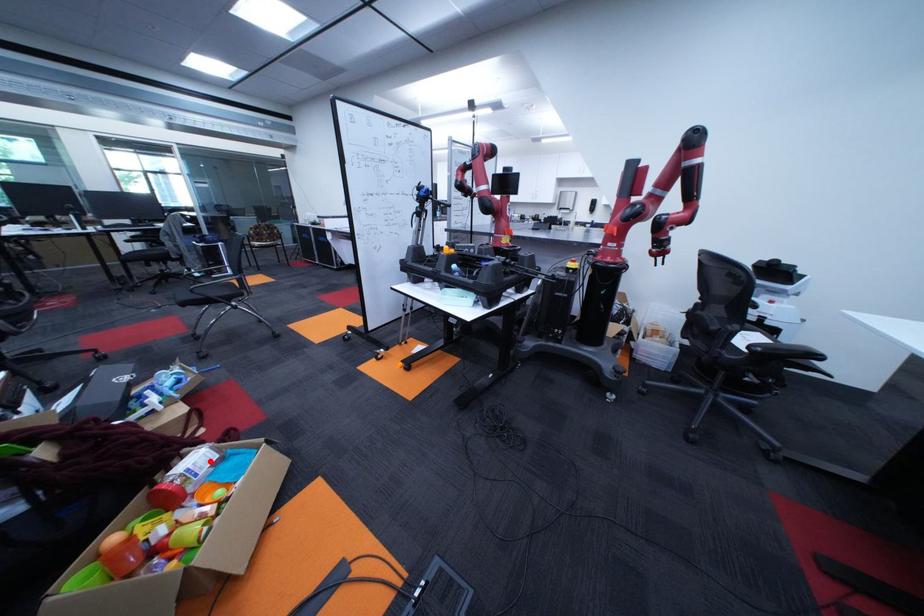
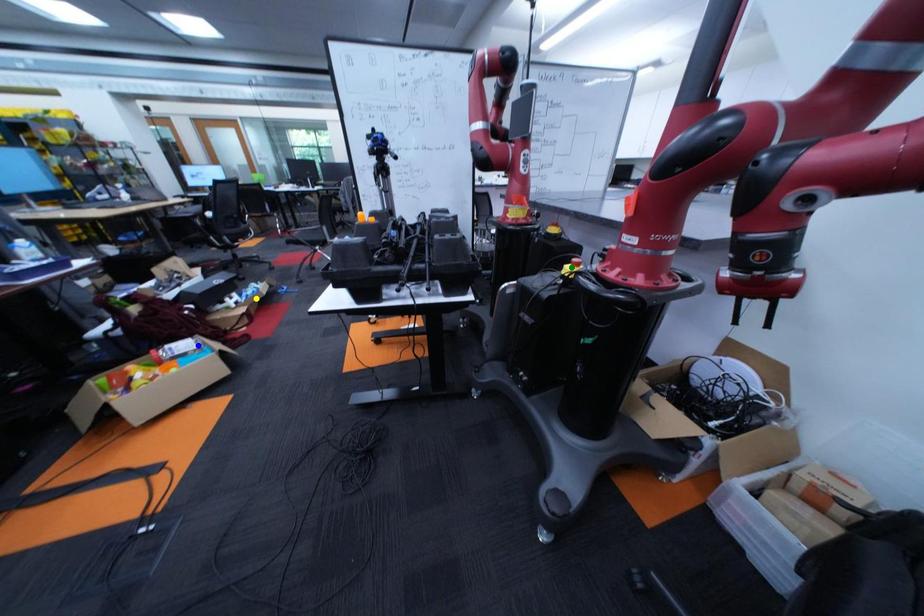
Question: I am providing you with two images of the same scene from different viewpoints. A red point is marked on the first image. You are given multiple points on the second image. Which point in image 2 represents the same 3d spot as the red point in image 1?

Choices:
 (A) blue point
 (B) green point
 (C) yellow point

Answer: (A)